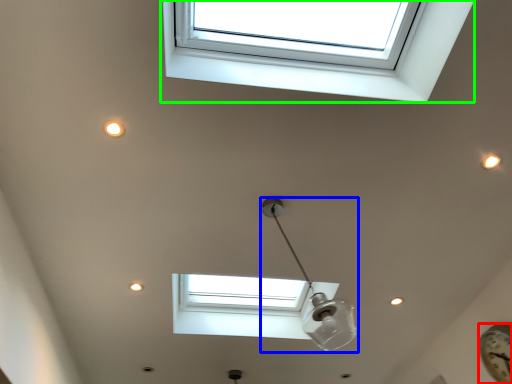
Question: Which is nearer to the clock (highlighted by a red box)? lamp (highlighted by a blue box) or window (highlighted by a green box).

Choices:
 (A) lamp
 (B) window

Answer: (A)